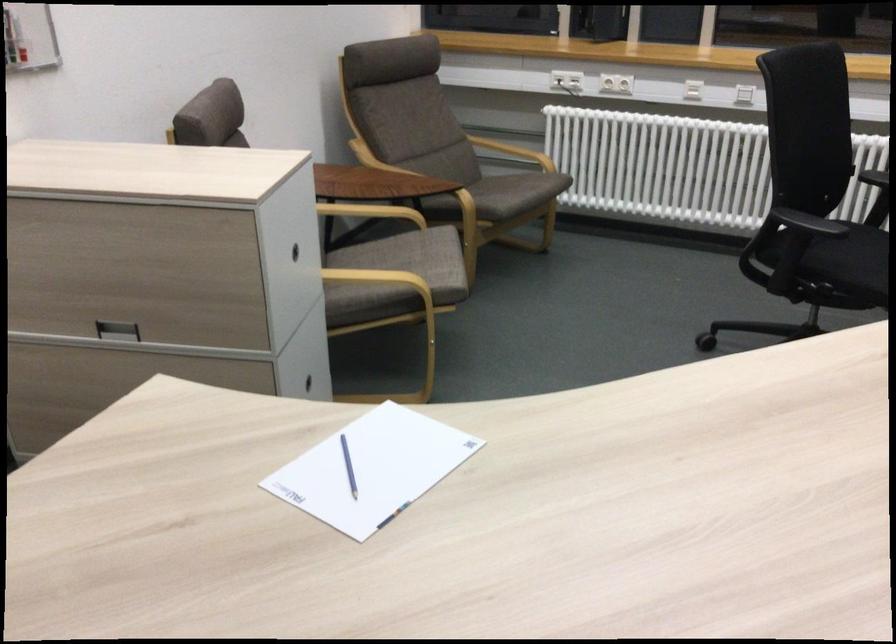
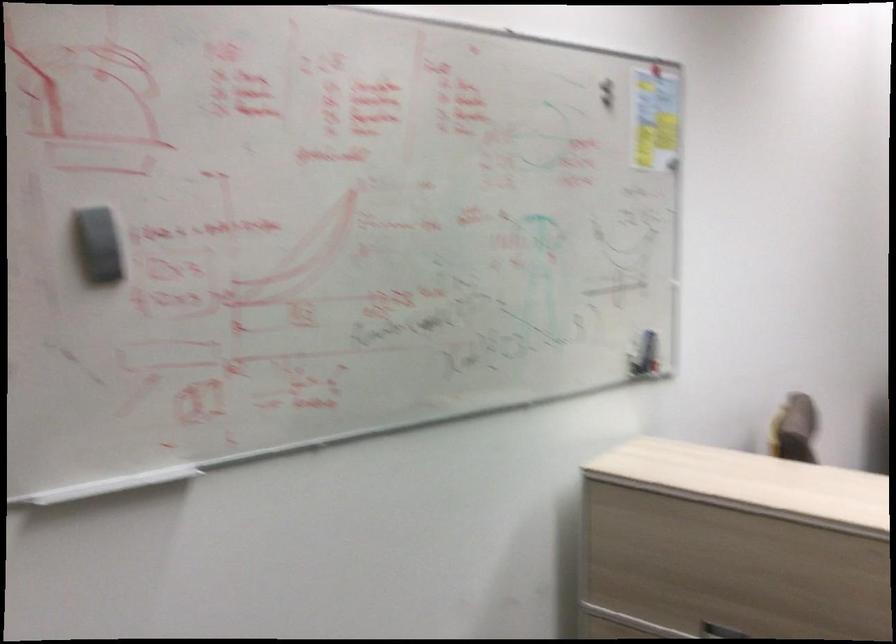
Based on the continuous images, in which direction is the camera rotating?

The rotation direction of the camera is left-up.